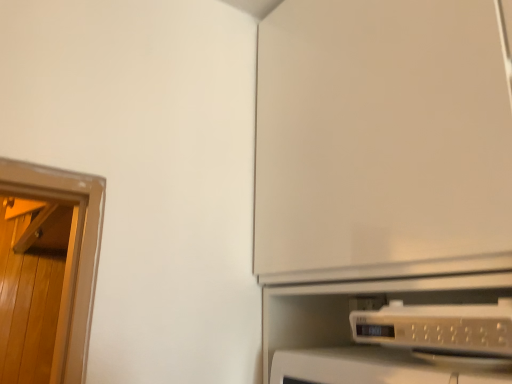
Locate an element on the screen. white plastic microwave at lower right is located at coordinates (438, 327).

What do you see at coordinates (438, 327) in the screenshot? I see `white plastic microwave at lower right` at bounding box center [438, 327].

This screenshot has width=512, height=384. What are the coordinates of `white plastic microwave at lower right` in the screenshot? It's located at (438, 327).